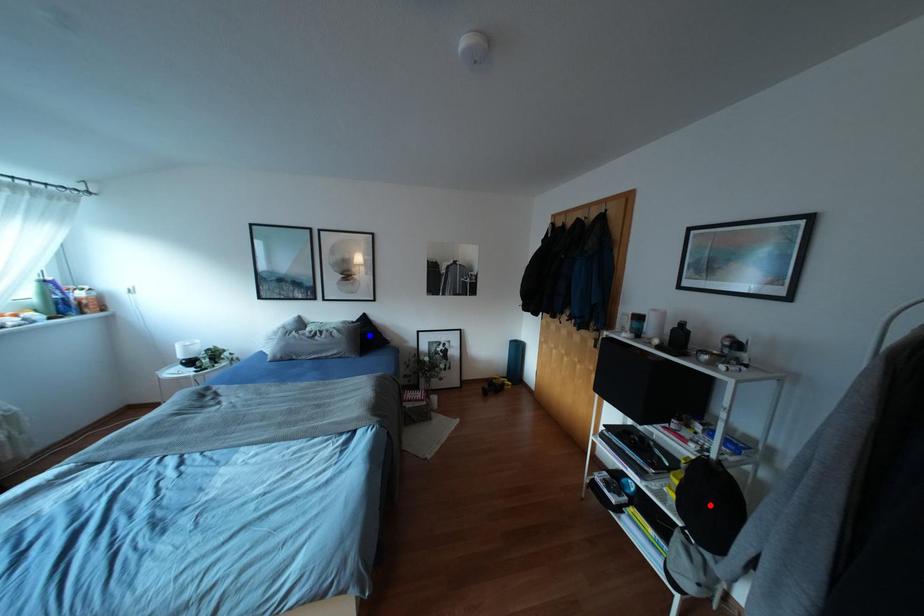
Question: In the image, two points are highlighted. Which point is nearer to the camera? Reply with the corresponding letter.

Choices:
 (A) blue point
 (B) red point

Answer: (B)